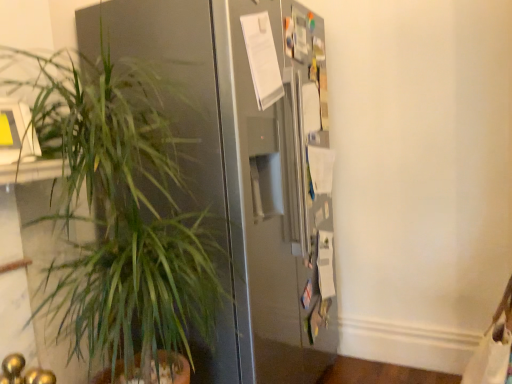
Where is `satin silver refrigerator at center`? satin silver refrigerator at center is located at coordinates (249, 176).

Describe the element at coordinates (249, 176) in the screenshot. The height and width of the screenshot is (384, 512). I see `satin silver refrigerator at center` at that location.

What do you see at coordinates (175, 80) in the screenshot? The height and width of the screenshot is (384, 512). I see `green leafy plant at left` at bounding box center [175, 80].

What is the approximate width of green leafy plant at left?

green leafy plant at left is 23.42 inches wide.

You are a GUI agent. You are given a task and a screenshot of the screen. Output one action in this format:
    pyautogui.click(x=<x>, y=<y>)
    Task: Click on the green leafy plant at left
    Image resolution: width=512 pixels, height=384 pixels.
    Given the screenshot: What is the action you would take?
    pyautogui.click(x=175, y=80)

Locate an element on the screen. satin silver refrigerator at center is located at coordinates (249, 176).

Between green leafy plant at left and satin silver refrigerator at center, which one appears on the left side from the viewer's perspective?

green leafy plant at left.

Is the depth of green leafy plant at left less than that of satin silver refrigerator at center?

Yes.

Does point (147, 40) appear closer or farther from the camera than point (245, 93)?

Point (147, 40) is positioned farther from the camera compared to point (245, 93).

From the image's perspective, is green leafy plant at left located above or below satin silver refrigerator at center?

green leafy plant at left is situated lower than satin silver refrigerator at center in the image.

From a real-world perspective, is green leafy plant at left located beneath satin silver refrigerator at center?

Yes, from a real-world perspective, green leafy plant at left is under satin silver refrigerator at center.

Is green leafy plant at left thinner than satin silver refrigerator at center?

Correct, the width of green leafy plant at left is less than that of satin silver refrigerator at center.

Considering the sizes of objects green leafy plant at left and satin silver refrigerator at center in the image provided, who is shorter, green leafy plant at left or satin silver refrigerator at center?

Standing shorter between the two is green leafy plant at left.

Based on the photo, can you confirm if green leafy plant at left is smaller than satin silver refrigerator at center?

Yes.

Is green leafy plant at left spatially inside satin silver refrigerator at center, or outside of it?

green leafy plant at left exists outside the volume of satin silver refrigerator at center.

Would you say green leafy plant at left is a long distance from satin silver refrigerator at center?

Actually, green leafy plant at left and satin silver refrigerator at center are a little close together.

Looking at this image, is green leafy plant at left oriented towards satin silver refrigerator at center?

No, green leafy plant at left is not facing towards satin silver refrigerator at center.

Locate an element on the screen. The height and width of the screenshot is (384, 512). refrigerator that appears behind the green leafy plant at left is located at coordinates (249, 176).

In the image, is satin silver refrigerator at center on the left side or the right side of green leafy plant at left?

Based on their positions, satin silver refrigerator at center is located to the right of green leafy plant at left.

Does satin silver refrigerator at center come behind green leafy plant at left?

Yes, satin silver refrigerator at center is further from the viewer.

Does point (233, 183) come closer to viewer compared to point (189, 61)?

That is True.

From the image's perspective, is satin silver refrigerator at center under green leafy plant at left?

Actually, satin silver refrigerator at center appears above green leafy plant at left in the image.

From a real-world perspective, between satin silver refrigerator at center and green leafy plant at left, who is vertically higher?

In real-world perspective, satin silver refrigerator at center is above.

From the picture: Considering the sizes of objects satin silver refrigerator at center and green leafy plant at left in the image provided, who is thinner, satin silver refrigerator at center or green leafy plant at left?

green leafy plant at left.

Between satin silver refrigerator at center and green leafy plant at left, which one has less height?

green leafy plant at left is shorter.

Can you confirm if satin silver refrigerator at center is smaller than green leafy plant at left?

Incorrect, satin silver refrigerator at center is not smaller in size than green leafy plant at left.

Which is correct: satin silver refrigerator at center is inside green leafy plant at left, or outside of it?

satin silver refrigerator at center is not enclosed by green leafy plant at left.

Is satin silver refrigerator at center touching green leafy plant at left?

No, satin silver refrigerator at center is not beside green leafy plant at left.

Could you tell me if satin silver refrigerator at center is turned towards green leafy plant at left?

No, satin silver refrigerator at center does not turn towards green leafy plant at left.

Based on the photo, how much distance is there between satin silver refrigerator at center and green leafy plant at left?

satin silver refrigerator at center is 7.82 inches from green leafy plant at left.

Find the location of a particular element. refrigerator on the right of green leafy plant at left is located at coordinates (249, 176).

This screenshot has height=384, width=512. Identify the location of refrigerator above the green leafy plant at left (from the image's perspective). click(x=249, y=176).

The width and height of the screenshot is (512, 384). What are the coordinates of `houseplant on the left of satin silver refrigerator at center` in the screenshot? It's located at (175, 80).